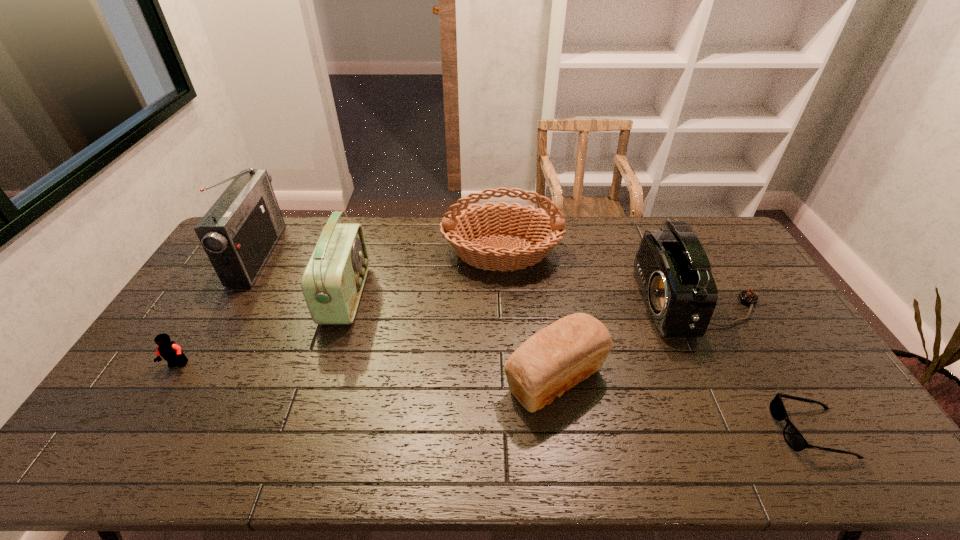
You are a GUI agent. You are given a task and a screenshot of the screen. Output one action in this format:
    pyautogui.click(x=<x>, y=<y>)
    Task: Click on the vacant point located on the front panel of the fifth object from right to left
    This screenshot has height=540, width=960.
    Given the screenshot: What is the action you would take?
    pyautogui.click(x=397, y=295)

Locate an element on the screen. This screenshot has height=540, width=960. vacant space located on the front-facing side of the rightmost radio receiver is located at coordinates (542, 303).

At what (x,y) coordinates should I click in order to perform the action: click on free space located 0.280m on the front-facing side of the rightmost radio receiver. Please return your answer as a coordinate pair (x, y). Looking at the image, I should click on point(555,303).

I want to click on vacant area located on the front-facing side of the rightmost radio receiver, so click(x=521, y=303).

Where is `free space located on the back of the third shortest object`? This screenshot has width=960, height=540. free space located on the back of the third shortest object is located at coordinates (542, 298).

Locate an element on the screen. This screenshot has width=960, height=540. free spot located on the front-facing side of the second shortest object is located at coordinates (153, 407).

Locate an element on the screen. free location located on the front-facing side of the sunglasses is located at coordinates (741, 431).

You are a GUI agent. You are given a task and a screenshot of the screen. Output one action in this format:
    pyautogui.click(x=<x>, y=<y>)
    Task: Click on the vacant position located on the front-facing side of the sunglasses
    The image size is (960, 540).
    Given the screenshot: What is the action you would take?
    pyautogui.click(x=745, y=431)

Find the location of `vacant space located 0.270m on the front-facing side of the sunglasses`. vacant space located 0.270m on the front-facing side of the sunglasses is located at coordinates (669, 431).

Identify the location of radio receiver that is at the far edge. (238, 233).